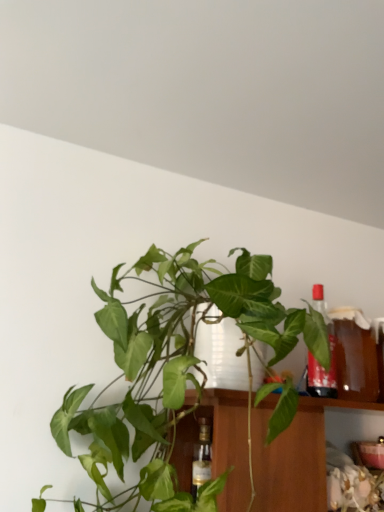
Question: Visually, is green leafy plant at center positioned to the left or to the right of translucent glass bottle at upper right?

Choices:
 (A) right
 (B) left

Answer: (B)

Question: From their relative heights in the image, would you say green leafy plant at center is taller or shorter than translucent glass bottle at upper right?

Choices:
 (A) tall
 (B) short

Answer: (A)

Question: Based on their sizes in the image, would you say green leafy plant at center is bigger or smaller than translucent glass bottle at upper right?

Choices:
 (A) big
 (B) small

Answer: (A)

Question: Looking at their shapes, would you say translucent glass bottle at upper right is wider or thinner than green leafy plant at center?

Choices:
 (A) wide
 (B) thin

Answer: (B)

Question: Looking at the image, does translucent glass bottle at upper right seem bigger or smaller compared to green leafy plant at center?

Choices:
 (A) big
 (B) small

Answer: (B)

Question: From a real-world perspective, is translucent glass bottle at upper right physically located above or below green leafy plant at center?

Choices:
 (A) above
 (B) below

Answer: (A)

Question: From the image's perspective, is translucent glass bottle at upper right positioned above or below green leafy plant at center?

Choices:
 (A) above
 (B) below

Answer: (B)